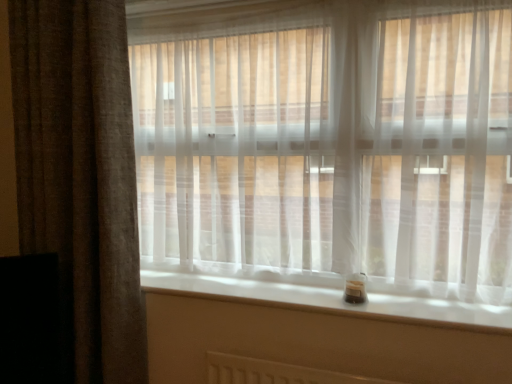
Question: In terms of height, does translucent white curtain at center, placed as the 1th curtain when sorted from right to left, look taller or shorter compared to brown textured curtain at left, arranged as the 2th curtain when viewed from the right?

Choices:
 (A) short
 (B) tall

Answer: (A)

Question: Is translucent white curtain at center, placed as the 1th curtain when sorted from right to left, bigger or smaller than brown textured curtain at left, acting as the 1th curtain starting from the left?

Choices:
 (A) big
 (B) small

Answer: (A)

Question: Estimate the real-world distances between objects in this image. Which object is farther from the translucent white curtain at center, arranged as the second curtain when viewed from the left?

Choices:
 (A) white smooth window sill at lower center
 (B) brown textured curtain at left, acting as the 1th curtain starting from the left

Answer: (B)

Question: Estimate the real-world distances between objects in this image. Which object is closer to the translucent white curtain at center, arranged as the second curtain when viewed from the left?

Choices:
 (A) brown textured curtain at left, arranged as the 2th curtain when viewed from the right
 (B) white smooth window sill at lower center

Answer: (B)